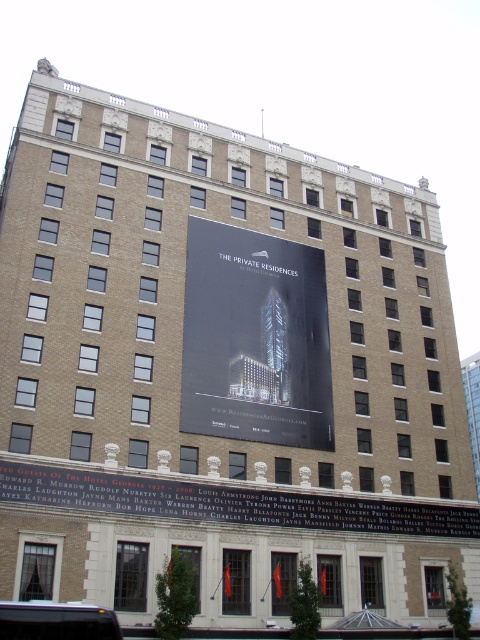
Identify the location of black glossy poster at center. (254, 339).

What are the coordinates of `black glossy poster at center` in the screenshot? It's located at (254, 339).